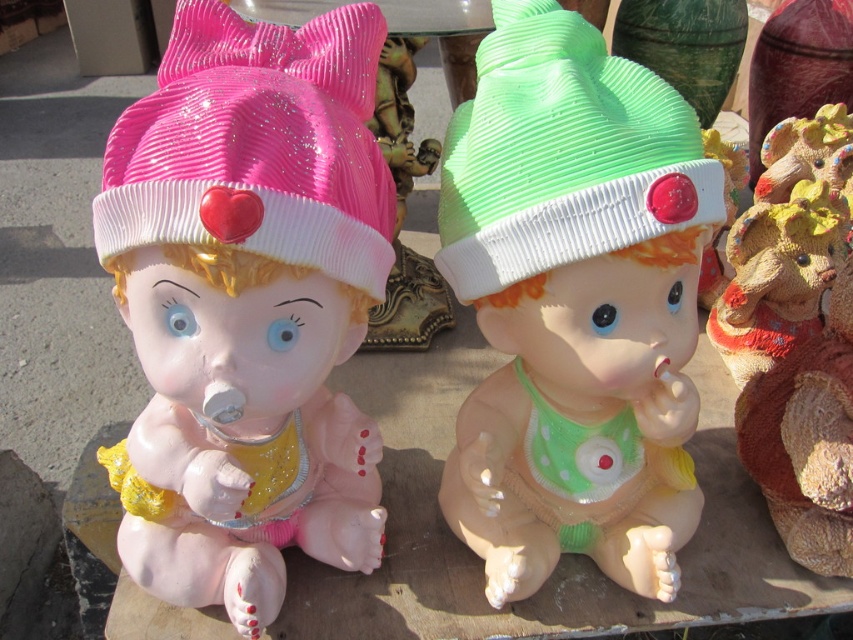
Does green matte knit hat at center appear under textured brown bear at right?

No.

Where is `green matte knit hat at center`? Image resolution: width=853 pixels, height=640 pixels. green matte knit hat at center is located at coordinates (561, 154).

In the scene shown: Does matte plastic doll at center have a smaller size compared to textured brown bear at right?

Correct, matte plastic doll at center occupies less space than textured brown bear at right.

Between matte plastic doll at center and textured brown bear at right, which one has less height?

Standing shorter between the two is matte plastic doll at center.

Between point (163, 205) and point (788, 369), which one is positioned behind?

Point (788, 369)

Where is `matte plastic doll at center`? matte plastic doll at center is located at coordinates (248, 301).

Does matte plastic doll at center have a lesser width compared to pink glittery hat at left?

Incorrect, matte plastic doll at center's width is not less than pink glittery hat at left's.

Which is behind, point (196, 166) or point (173, 180)?

Point (196, 166)

Is point (276, 502) positioned in front of point (213, 140)?

No, (276, 502) is behind (213, 140).

Identify the location of matte plastic doll at center. (248, 301).